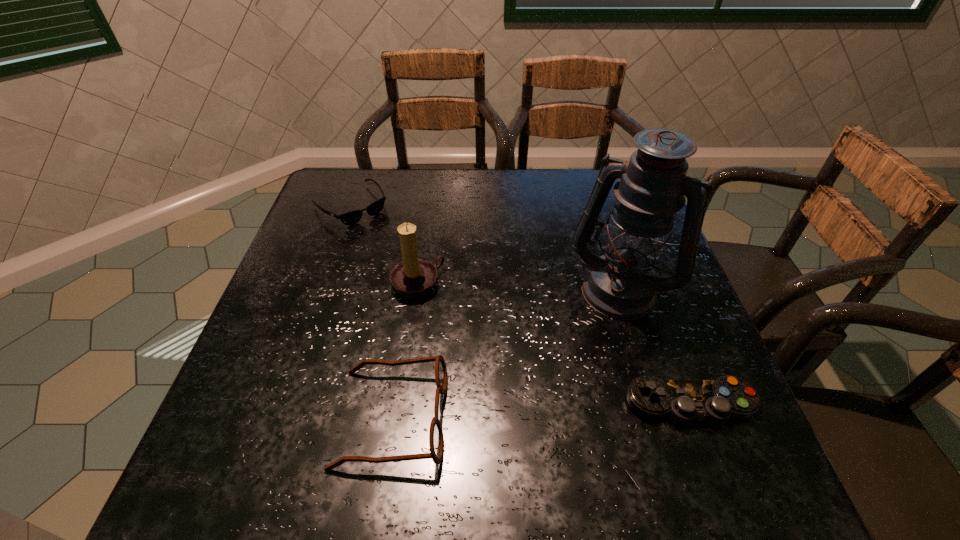
This screenshot has height=540, width=960. Find the location of `vacant space situated on the front-facing side of the tallest object`. vacant space situated on the front-facing side of the tallest object is located at coordinates (583, 359).

Where is `vacant point located on the wick of the second tallest object`? This screenshot has width=960, height=540. vacant point located on the wick of the second tallest object is located at coordinates (543, 406).

Find the location of a particular element. Image resolution: width=960 pixels, height=540 pixels. free space located on the wick of the second tallest object is located at coordinates (449, 314).

Where is `vacant space located on the wick of the second tallest object`? The image size is (960, 540). vacant space located on the wick of the second tallest object is located at coordinates (556, 417).

You are a GUI agent. You are given a task and a screenshot of the screen. Output one action in this format:
    pyautogui.click(x=<x>, y=<y>)
    Task: Click on the vacant region located on the front-facing side of the leftmost object
    The width and height of the screenshot is (960, 540).
    Given the screenshot: What is the action you would take?
    pyautogui.click(x=435, y=291)

This screenshot has height=540, width=960. I want to click on vacant space located 0.310m on the front-facing side of the leftmost object, so click(x=433, y=288).

Where is `vacant space located on the front-facing side of the leftmost object`? The height and width of the screenshot is (540, 960). vacant space located on the front-facing side of the leftmost object is located at coordinates (x=410, y=266).

Where is `object at the far edge`? object at the far edge is located at coordinates (352, 217).

The width and height of the screenshot is (960, 540). I want to click on spectacles at the near edge, so click(436, 439).

Identify the location of control located in the near edge section of the desktop. (682, 401).